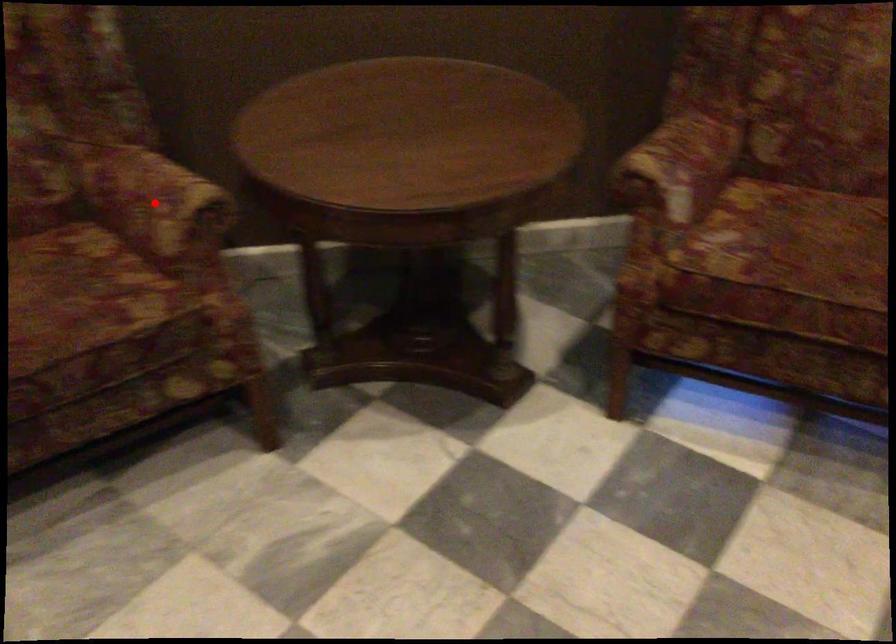
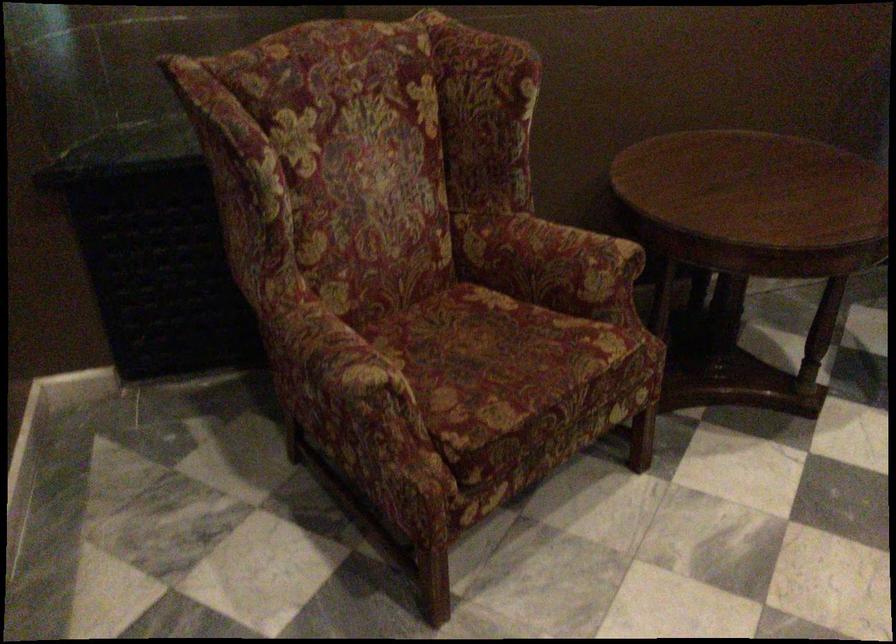
Find the pixel in the second image that matches the highlighted location in the first image.

(572, 256)